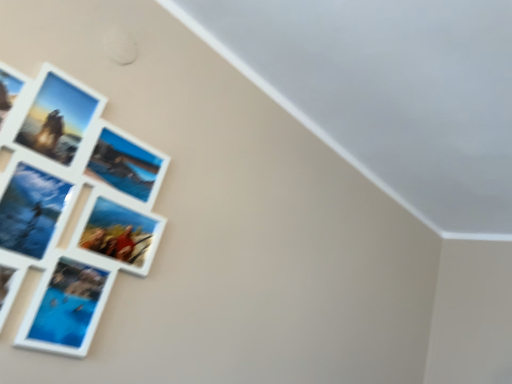
The image size is (512, 384). Describe the element at coordinates (70, 211) in the screenshot. I see `white matte picture frame at upper left` at that location.

This screenshot has width=512, height=384. I want to click on white matte picture frame at upper left, so click(70, 211).

What is the approximate width of white matte picture frame at upper left?

The width of white matte picture frame at upper left is 1.39 inches.

Image resolution: width=512 pixels, height=384 pixels. In order to click on white matte picture frame at upper left in this screenshot , I will do `click(70, 211)`.